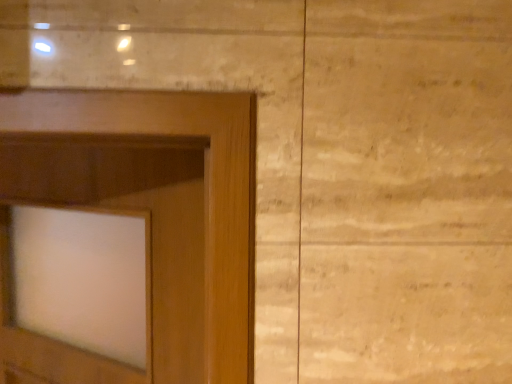
In order to face wooden door at left, should I rotate leftwards or rightwards?

It's best to rotate left around 22.814 degrees.

What do you see at coordinates (205, 188) in the screenshot?
I see `wooden door at left` at bounding box center [205, 188].

Image resolution: width=512 pixels, height=384 pixels. In order to click on wooden door at left in this screenshot , I will do `click(205, 188)`.

Identify the location of wooden door at left. The image size is (512, 384). (205, 188).